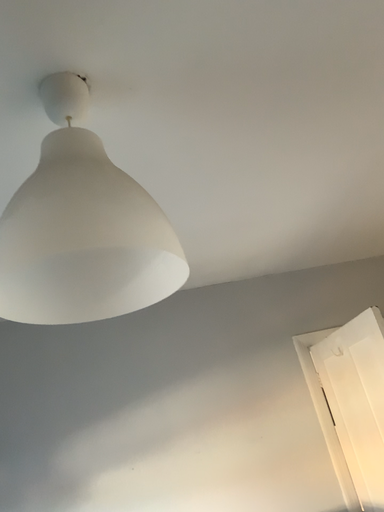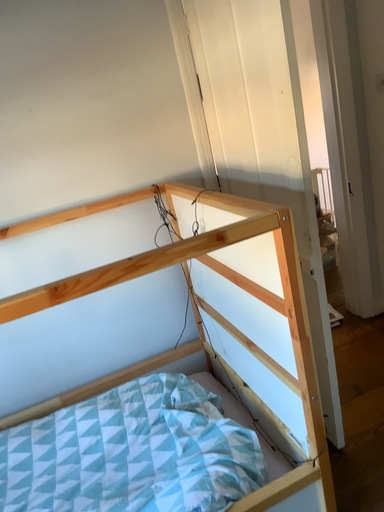
Question: Which way did the camera rotate in the video?

Choices:
 (A) rotated downward
 (B) rotated upward

Answer: (A)